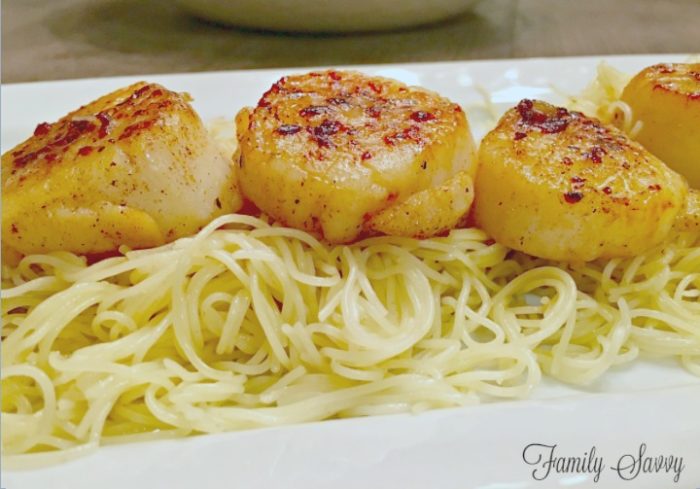
At what (x,y) coordinates should I click in order to perform the action: click on bowl. Please return your answer as a coordinate pair (x, y). Looking at the image, I should click on (346, 16).